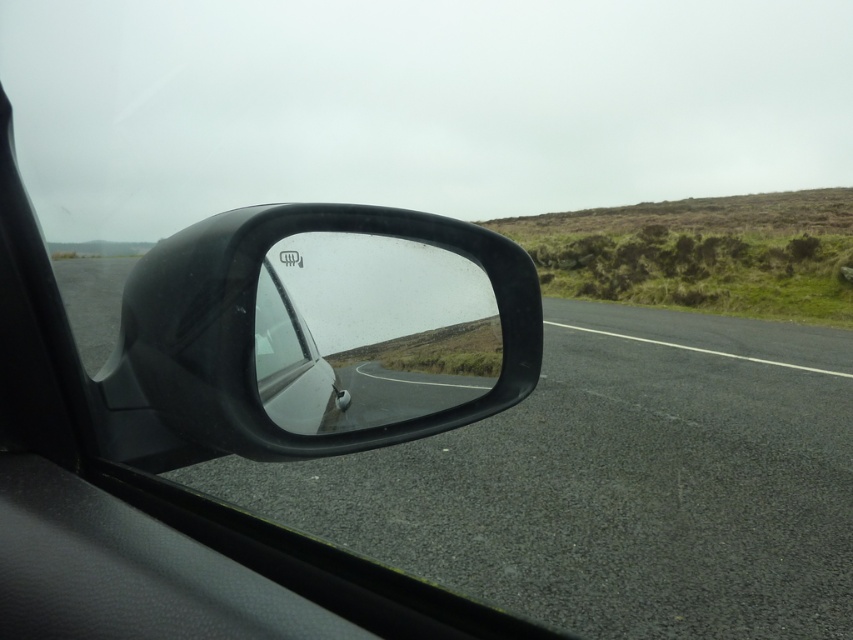
Based on the photo, can you confirm if asphalt road at center is positioned below black matte car mirror at center?

Yes, asphalt road at center is below black matte car mirror at center.

Identify the location of asphalt road at center. (614, 483).

Does black matte car mirror at center appear on the right side of glossy plastic car mirror at center?

Incorrect, black matte car mirror at center is not on the right side of glossy plastic car mirror at center.

The image size is (853, 640). What do you see at coordinates (318, 333) in the screenshot? I see `black matte car mirror at center` at bounding box center [318, 333].

You are a GUI agent. You are given a task and a screenshot of the screen. Output one action in this format:
    pyautogui.click(x=<x>, y=<y>)
    Task: Click on the black matte car mirror at center
    The height and width of the screenshot is (640, 853).
    Given the screenshot: What is the action you would take?
    pyautogui.click(x=318, y=333)

Is asphalt road at center to the left of glossy plastic car mirror at center from the viewer's perspective?

Incorrect, asphalt road at center is not on the left side of glossy plastic car mirror at center.

Who is positioned more to the right, asphalt road at center or glossy plastic car mirror at center?

Positioned to the right is asphalt road at center.

Where is `asphalt road at center`? This screenshot has height=640, width=853. asphalt road at center is located at coordinates (614, 483).

Image resolution: width=853 pixels, height=640 pixels. What are the coordinates of `asphalt road at center` in the screenshot? It's located at (614, 483).